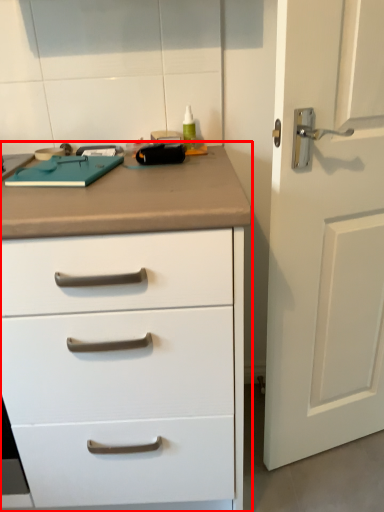
Question: From the image, what is the correct spatial relationship of chest of drawers (annotated by the red box) in relation to door?

Choices:
 (A) left
 (B) right

Answer: (A)